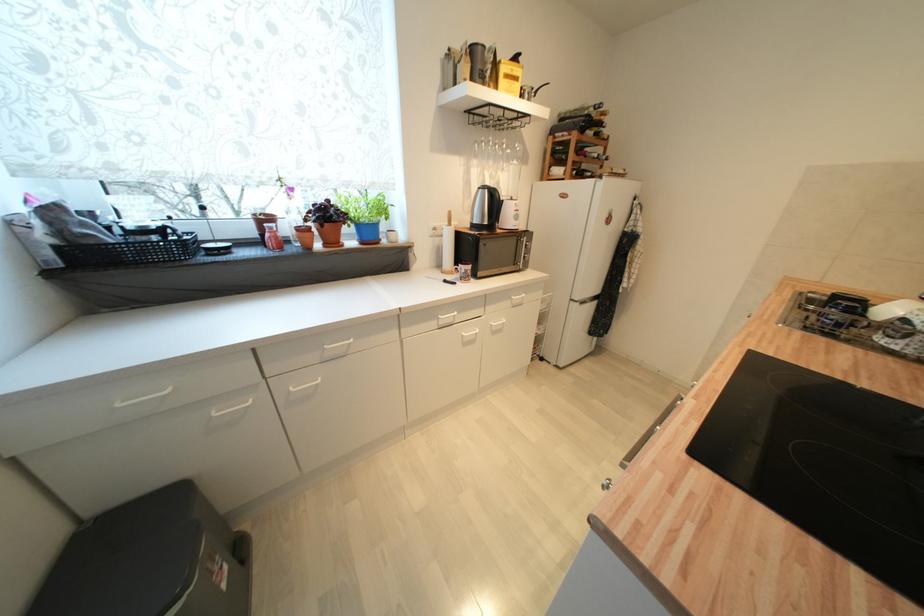
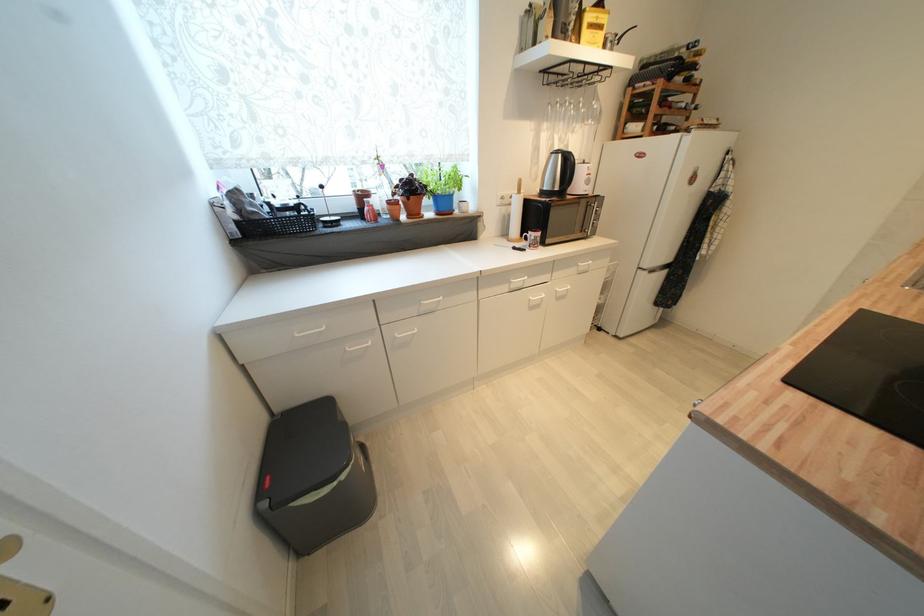
Where in the second image is the point corresponding to (x=603, y=175) from the first image?

(690, 127)